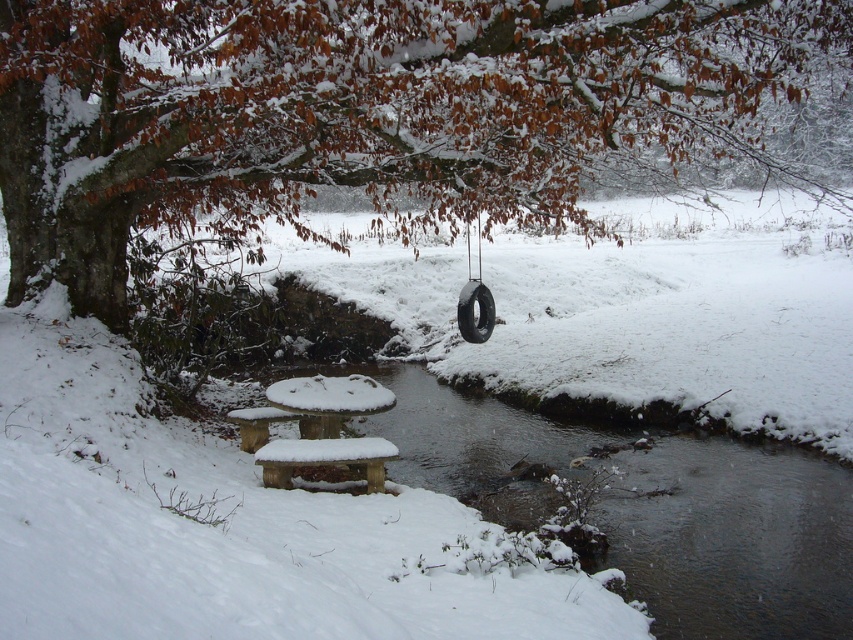
Where is `snow-covered wooden stream at lower center`? This screenshot has width=853, height=640. snow-covered wooden stream at lower center is located at coordinates pos(645,506).

Is snow-covered wooden stream at lower center shorter than black rubber tire at center?

In fact, snow-covered wooden stream at lower center may be taller than black rubber tire at center.

Which is behind, point (834, 470) or point (480, 342)?

The point (480, 342) is more distant.

Identify the location of snow-covered wooden stream at lower center. (645, 506).

Is snow-covered wood picnic table at lower center to the right of black rubber tire at center from the viewer's perspective?

In fact, snow-covered wood picnic table at lower center is to the left of black rubber tire at center.

Which is below, snow-covered wood picnic table at lower center or black rubber tire at center?

Positioned lower is snow-covered wood picnic table at lower center.

Is point (287, 440) behind point (469, 332)?

No.

Locate an element on the screen. snow-covered wood picnic table at lower center is located at coordinates (317, 428).

Between snow-covered tree at upper left and black rubber tire at center, which one has less height?

black rubber tire at center is shorter.

From the picture: Does snow-covered tree at upper left appear on the left side of black rubber tire at center?

Incorrect, snow-covered tree at upper left is not on the left side of black rubber tire at center.

The height and width of the screenshot is (640, 853). Describe the element at coordinates (357, 108) in the screenshot. I see `snow-covered tree at upper left` at that location.

Identify the location of snow-covered tree at upper left. (357, 108).